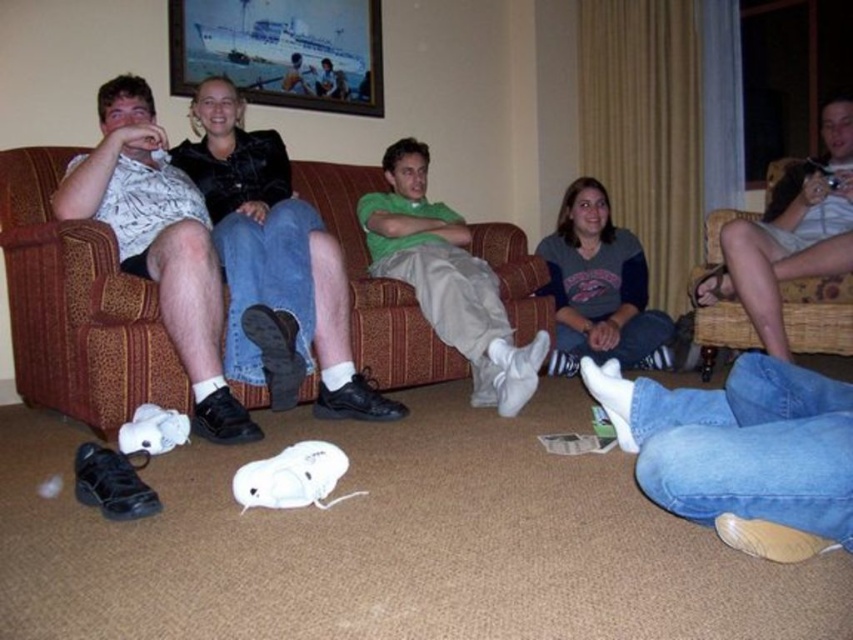
Question: In this image, where is green matte shirt at center located relative to light brown wicker chair at right?

Choices:
 (A) below
 (B) above

Answer: (A)

Question: Which object is farther from the camera taking this photo?

Choices:
 (A) white matte sneakers at lower left
 (B) brown fabric couch at center

Answer: (B)

Question: Based on their relative distances, which object is nearer to the green matte shirt at center?

Choices:
 (A) white matte sneakers at lower left
 (B) matte black sneakers at left
 (C) brown fabric couch at center

Answer: (C)

Question: Which point is closer to the camera?

Choices:
 (A) brown fabric couch at center
 (B) white matte sneakers at lower left

Answer: (B)

Question: Does white matte sneakers at lower left have a larger size compared to matte black sneakers at left?

Choices:
 (A) yes
 (B) no

Answer: (A)

Question: Can you confirm if brown fabric couch at center is positioned below green matte shirt at center?

Choices:
 (A) no
 (B) yes

Answer: (B)